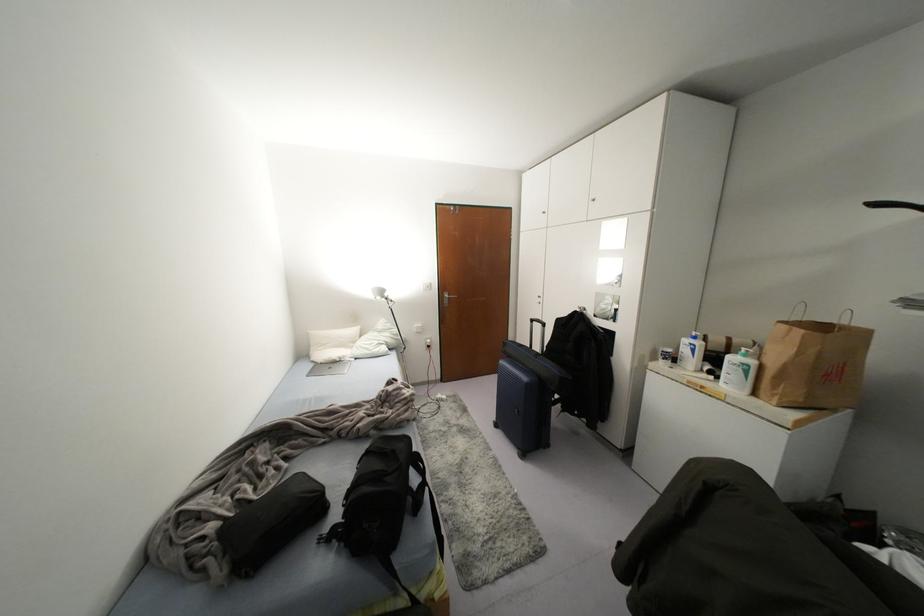
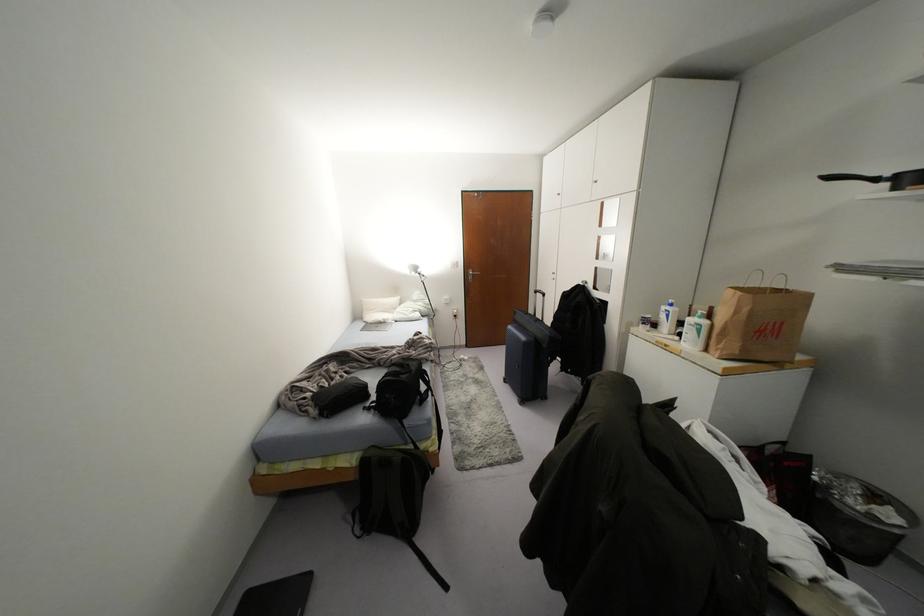
The point at (354, 330) is marked in the first image. Where is the corresponding point in the second image?

(394, 299)